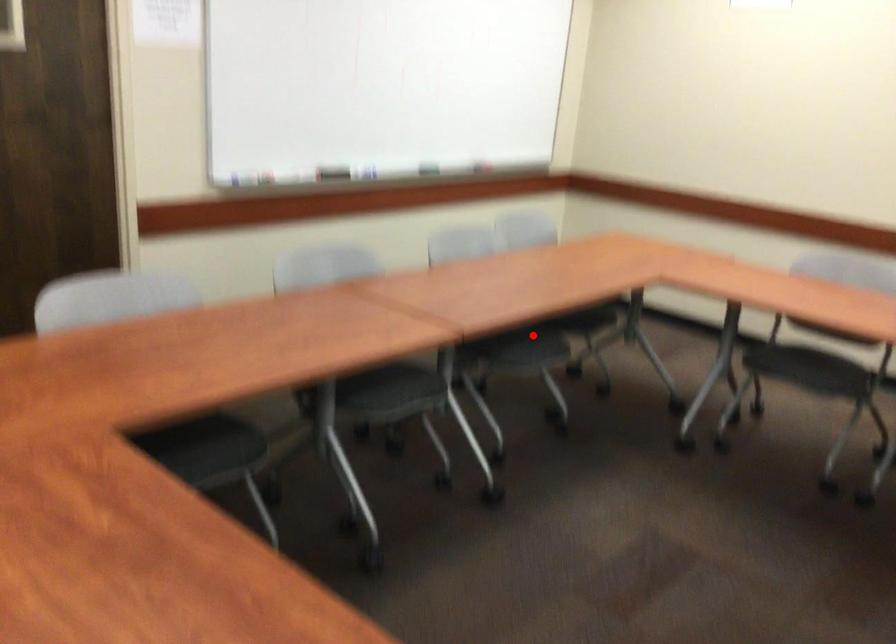
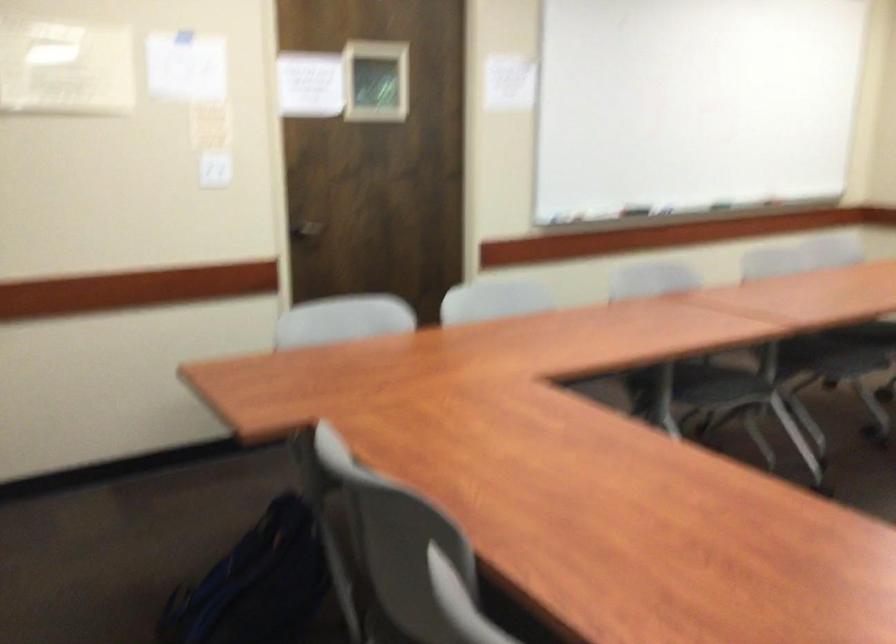
Where in the second image is the point corresponding to the highlighted location from the first image?

(860, 341)